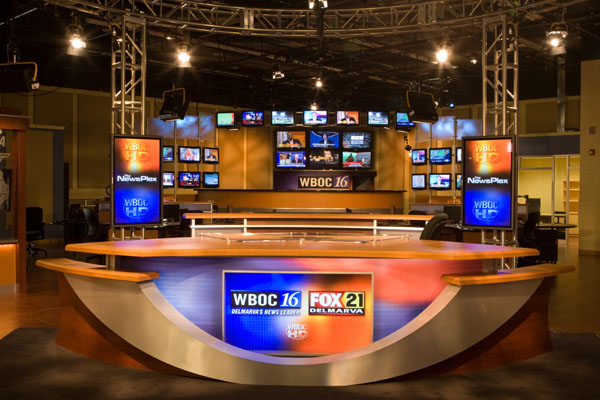
The width and height of the screenshot is (600, 400). I want to click on ceiling, so click(x=226, y=42).